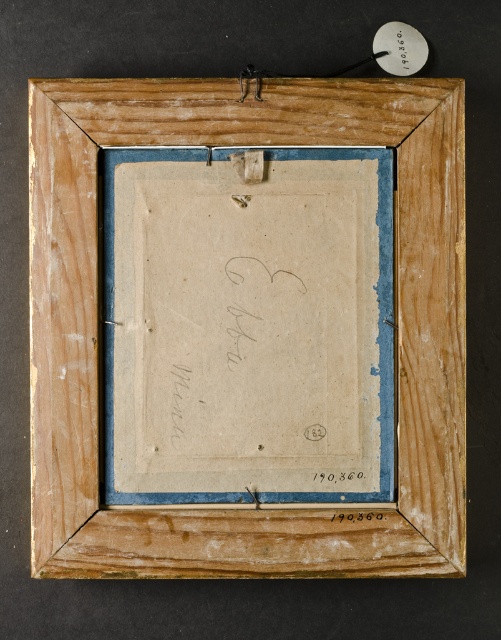
What do you see at coordinates (97, 326) in the screenshot? I see `wooden picture frame at center` at bounding box center [97, 326].

Can you confirm if wooden picture frame at center is taller than black ink signature at center?

Indeed, wooden picture frame at center has a greater height compared to black ink signature at center.

What do you see at coordinates (97, 326) in the screenshot? I see `wooden picture frame at center` at bounding box center [97, 326].

Find the location of a particular element. wooden picture frame at center is located at coordinates (97, 326).